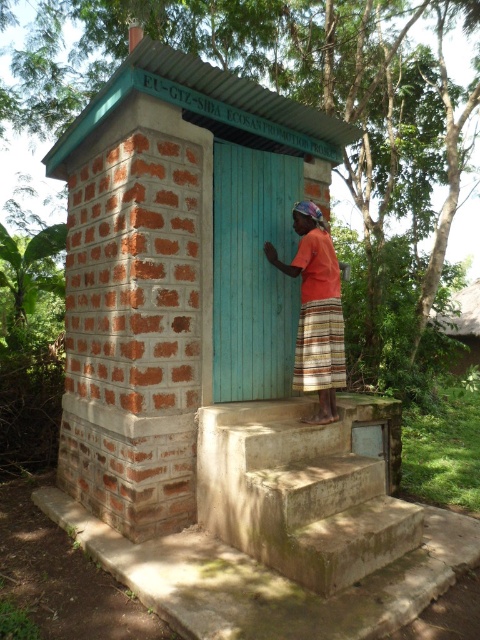
You are standing in front of the brick structure and see the concrete stairs at center and the orange cotton shirt at center. Which object is closer to the ground?

The concrete stairs at center is positioned under orange cotton shirt at center, so the concrete stairs at center is closer to the ground.

You are standing in front of the brick hut at center and the concrete stairs at center. Which one do you think is larger in size?

The brick hut at center is bigger than concrete stairs at center, so the brick hut at center is larger in size.

Based on the photo, you are standing in front of the brick hut at center and want to go down to the concrete stairs at center. In which direction should you move?

You should move to the right to reach the concrete stairs at center because the brick hut at center is located to the left of the concrete stairs at center.